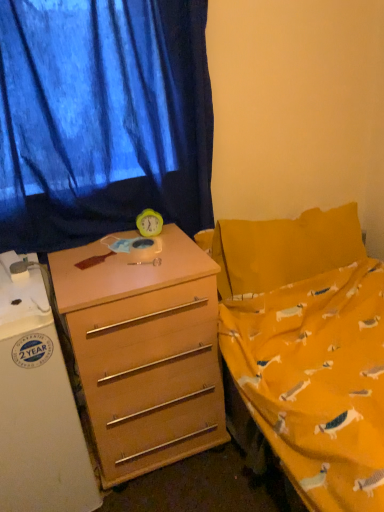
Question: Is yellow plastic clock at center far from blue fabric curtain at upper left?

Choices:
 (A) yes
 (B) no

Answer: (B)

Question: Does yellow plastic clock at center have a larger size compared to blue fabric curtain at upper left?

Choices:
 (A) no
 (B) yes

Answer: (A)

Question: Can you confirm if yellow plastic clock at center is positioned to the left of blue fabric curtain at upper left?

Choices:
 (A) yes
 (B) no

Answer: (B)

Question: From the image's perspective, does yellow plastic clock at center appear higher than blue fabric curtain at upper left?

Choices:
 (A) yes
 (B) no

Answer: (B)

Question: Is yellow plastic clock at center oriented towards blue fabric curtain at upper left?

Choices:
 (A) yes
 (B) no

Answer: (B)

Question: Is the depth of yellow plastic clock at center less than that of blue fabric curtain at upper left?

Choices:
 (A) no
 (B) yes

Answer: (A)

Question: Considering the relative positions of white glossy refrigerator at left and light brown wood desk at center in the image provided, is white glossy refrigerator at left in front of light brown wood desk at center?

Choices:
 (A) yes
 (B) no

Answer: (A)

Question: Can you confirm if white glossy refrigerator at left is taller than light brown wood desk at center?

Choices:
 (A) no
 (B) yes

Answer: (B)

Question: Is white glossy refrigerator at left smaller than light brown wood desk at center?

Choices:
 (A) no
 (B) yes

Answer: (B)

Question: Is white glossy refrigerator at left at the left side of light brown wood desk at center?

Choices:
 (A) no
 (B) yes

Answer: (B)

Question: From a real-world perspective, is white glossy refrigerator at left positioned under light brown wood desk at center based on gravity?

Choices:
 (A) no
 (B) yes

Answer: (A)

Question: Would you say light brown wood desk at center is part of white glossy refrigerator at left's contents?

Choices:
 (A) no
 (B) yes

Answer: (A)

Question: From a real-world perspective, is white glossy refrigerator at left over yellow plastic clock at center?

Choices:
 (A) no
 (B) yes

Answer: (A)